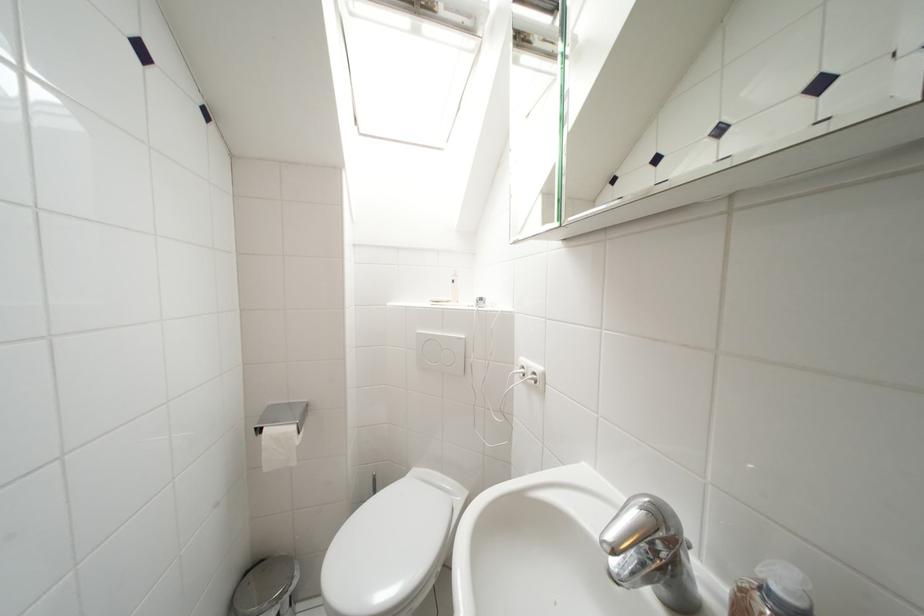
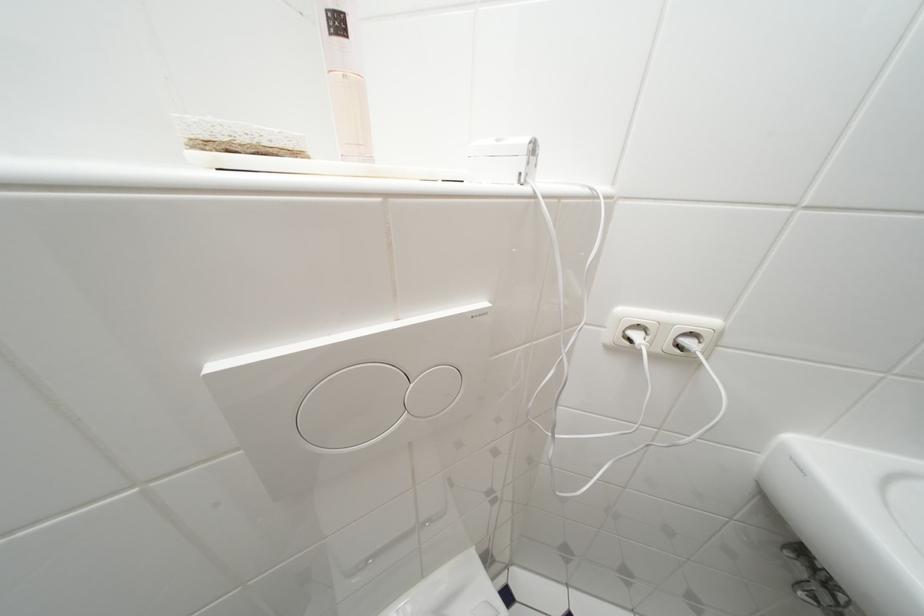
Looking at this image, how did the camera likely rotate?

The camera rotated toward right-down.